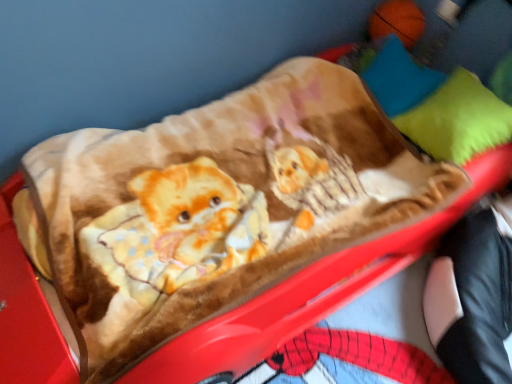
Question: From a real-world perspective, is blue soft pillow at upper right, the 2th pillow ordered from the bottom, located beneath black leather pants at lower right?

Choices:
 (A) no
 (B) yes

Answer: (A)

Question: From the image's perspective, is blue soft pillow at upper right, the 1th pillow when ordered from top to bottom, located beneath black leather pants at lower right?

Choices:
 (A) yes
 (B) no

Answer: (B)

Question: Is blue soft pillow at upper right, the 2th pillow ordered from the bottom, not close to black leather pants at lower right?

Choices:
 (A) no
 (B) yes

Answer: (A)

Question: Can you see blue soft pillow at upper right, the 1th pillow when ordered from top to bottom, touching black leather pants at lower right?

Choices:
 (A) yes
 (B) no

Answer: (B)

Question: Is blue soft pillow at upper right, the 2th pillow ordered from the bottom, smaller than black leather pants at lower right?

Choices:
 (A) yes
 (B) no

Answer: (A)

Question: Is black leather pants at lower right situated inside green soft pillow at upper right, arranged as the second pillow when viewed from the top, or outside?

Choices:
 (A) inside
 (B) outside

Answer: (B)

Question: Does point (475, 266) appear closer or farther from the camera than point (481, 112)?

Choices:
 (A) closer
 (B) farther

Answer: (A)

Question: From the image's perspective, is black leather pants at lower right located above or below green soft pillow at upper right, the 1th pillow in the bottom-to-top sequence?

Choices:
 (A) above
 (B) below

Answer: (B)

Question: In terms of width, does black leather pants at lower right look wider or thinner when compared to green soft pillow at upper right, the 1th pillow in the bottom-to-top sequence?

Choices:
 (A) thin
 (B) wide

Answer: (B)

Question: Considering the positions of blue soft pillow at upper right, the 1th pillow when ordered from top to bottom, and black leather pants at lower right in the image, is blue soft pillow at upper right, the 1th pillow when ordered from top to bottom, bigger or smaller than black leather pants at lower right?

Choices:
 (A) small
 (B) big

Answer: (A)

Question: Considering the positions of blue soft pillow at upper right, the 1th pillow when ordered from top to bottom, and black leather pants at lower right in the image, is blue soft pillow at upper right, the 1th pillow when ordered from top to bottom, wider or thinner than black leather pants at lower right?

Choices:
 (A) wide
 (B) thin

Answer: (B)

Question: From their relative heights in the image, would you say blue soft pillow at upper right, the 1th pillow when ordered from top to bottom, is taller or shorter than black leather pants at lower right?

Choices:
 (A) short
 (B) tall

Answer: (A)

Question: Relative to black leather pants at lower right, is blue soft pillow at upper right, the 2th pillow ordered from the bottom, in front or behind?

Choices:
 (A) behind
 (B) front

Answer: (A)

Question: From the image's perspective, is black leather pants at lower right above or below blue soft pillow at upper right, the 2th pillow ordered from the bottom?

Choices:
 (A) above
 (B) below

Answer: (B)

Question: Is point (477, 213) closer or farther from the camera than point (381, 61)?

Choices:
 (A) closer
 (B) farther

Answer: (A)